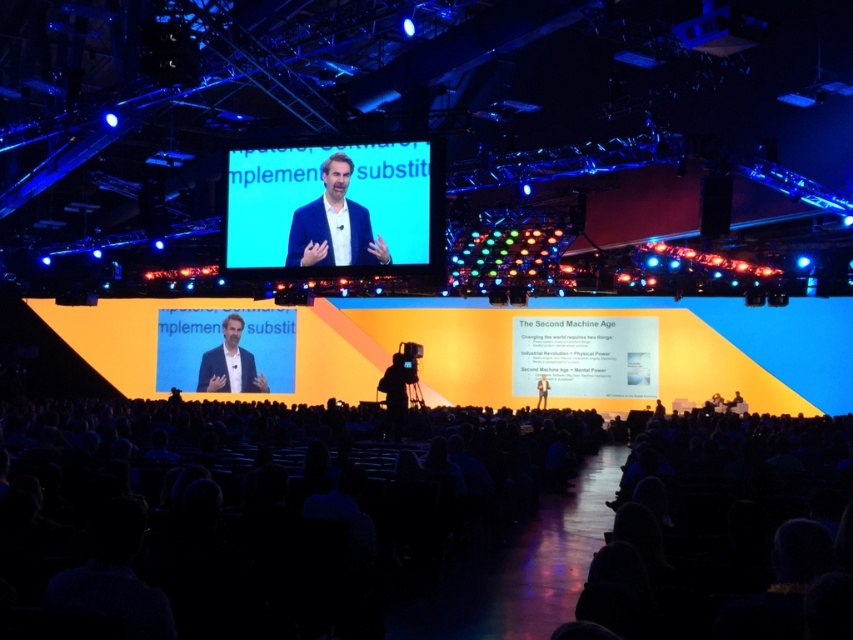
Question: Does dark blue fabric at lower center lie behind light brown leather jacket at center?

Choices:
 (A) yes
 (B) no

Answer: (B)

Question: Which object is the closest to the light brown leather jacket at center?

Choices:
 (A) blue fabric screen at center
 (B) matte black suit at center

Answer: (B)

Question: Which point is farther to the camera?

Choices:
 (A) light brown leather jacket at center
 (B) blue fabric screen at center
 (C) matte black suit at center

Answer: (C)

Question: Is blue fabric screen at center smaller than blue fabric at upper center?

Choices:
 (A) yes
 (B) no

Answer: (B)

Question: Can you confirm if matte black suit at center is smaller than light brown leather jacket at center?

Choices:
 (A) yes
 (B) no

Answer: (A)

Question: Estimate the real-world distances between objects in this image. Which object is closer to the blue fabric screen at center?

Choices:
 (A) light brown leather jacket at center
 (B) dark blue fabric at lower center

Answer: (B)